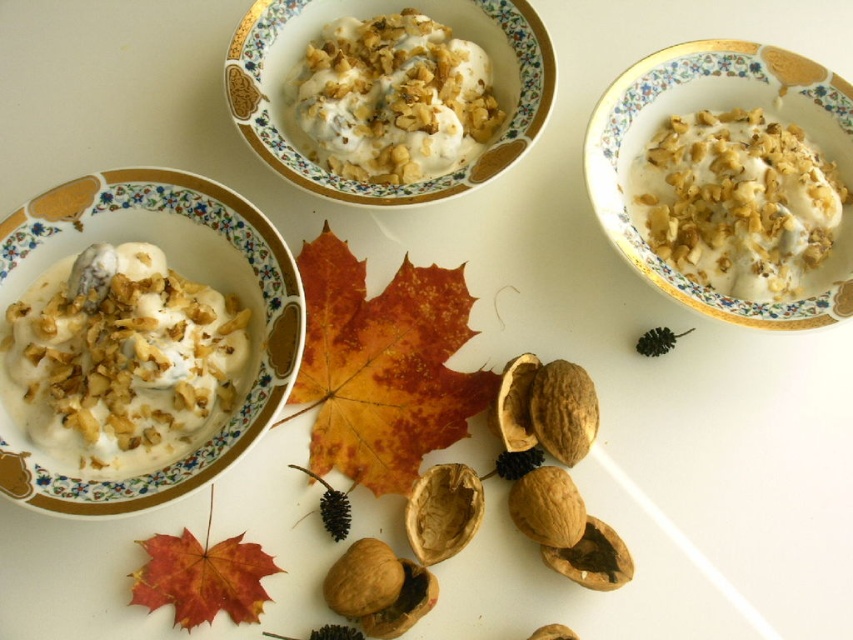
Which of these two, orange matte leaf at center or white creamy cereal at center, stands taller?

orange matte leaf at center

This screenshot has height=640, width=853. What do you see at coordinates (381, 365) in the screenshot?
I see `orange matte leaf at center` at bounding box center [381, 365].

You are a GUI agent. You are given a task and a screenshot of the screen. Output one action in this format:
    pyautogui.click(x=<x>, y=<y>)
    Task: Click on the orange matte leaf at center
    
    Given the screenshot: What is the action you would take?
    pyautogui.click(x=381, y=365)

Is matte white bowl at left taller than orange matte maple leaf at lower left?

Yes.

Is matte white bowl at left smaller than orange matte maple leaf at lower left?

No, matte white bowl at left is not smaller than orange matte maple leaf at lower left.

The image size is (853, 640). What are the coordinates of `matte white bowl at left` in the screenshot? It's located at (184, 275).

In order to click on matte white bowl at left in this screenshot , I will do `click(184, 275)`.

From the picture: Does matte white bowl at left come in front of orange matte leaf at center?

Yes, matte white bowl at left is closer to the viewer.

Can you confirm if matte white bowl at left is thinner than orange matte leaf at center?

No, matte white bowl at left is not thinner than orange matte leaf at center.

Where is `matte white bowl at left`? Image resolution: width=853 pixels, height=640 pixels. matte white bowl at left is located at coordinates (184, 275).